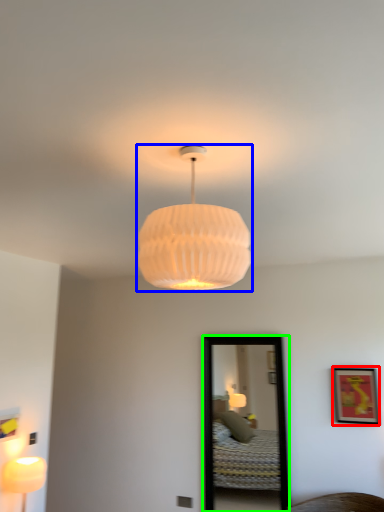
Question: Which is farther away from picture frame (highlighted by a red box)? lamp (highlighted by a blue box) or mirror (highlighted by a green box)?

Choices:
 (A) lamp
 (B) mirror

Answer: (A)